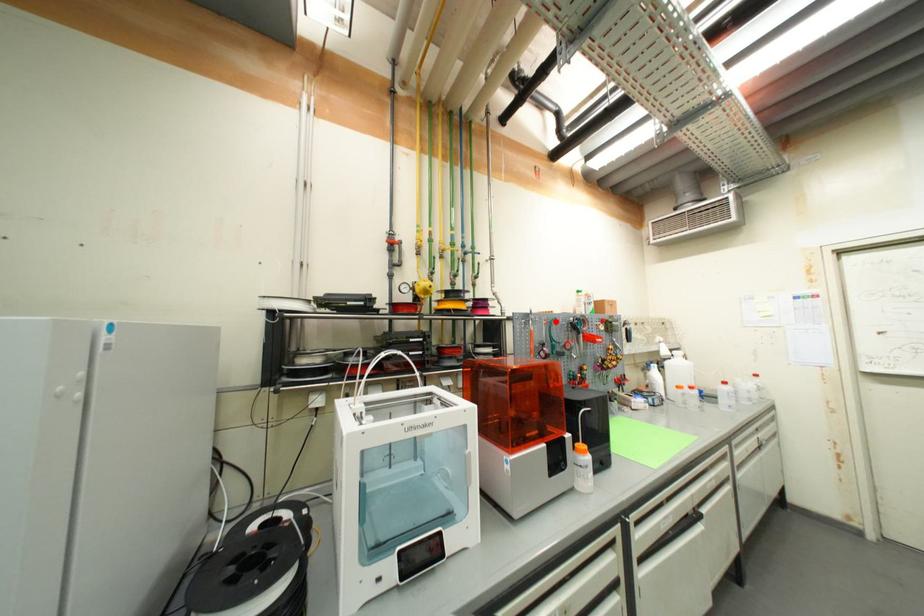
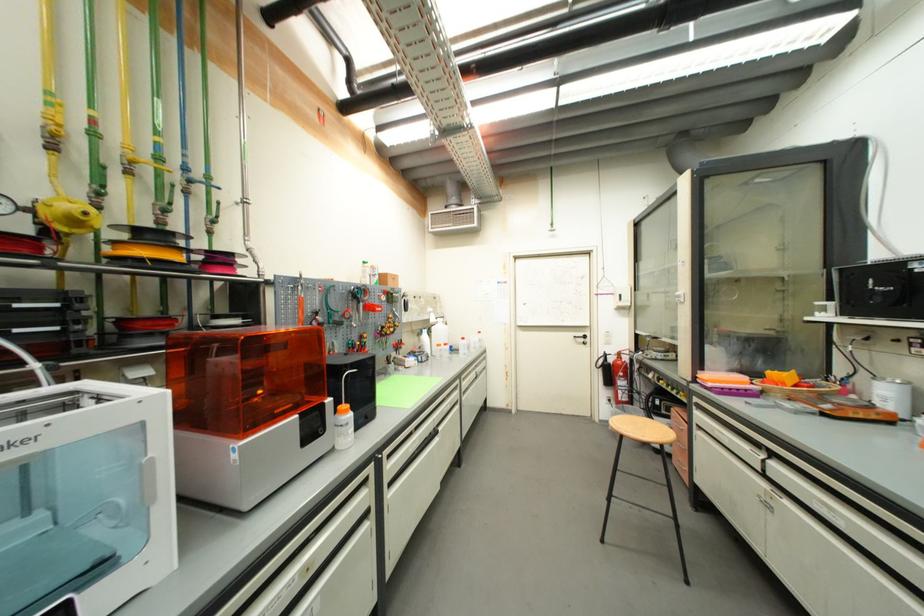
Find the pixel in the second image that matches the highlighted location in the first image.

(334, 289)